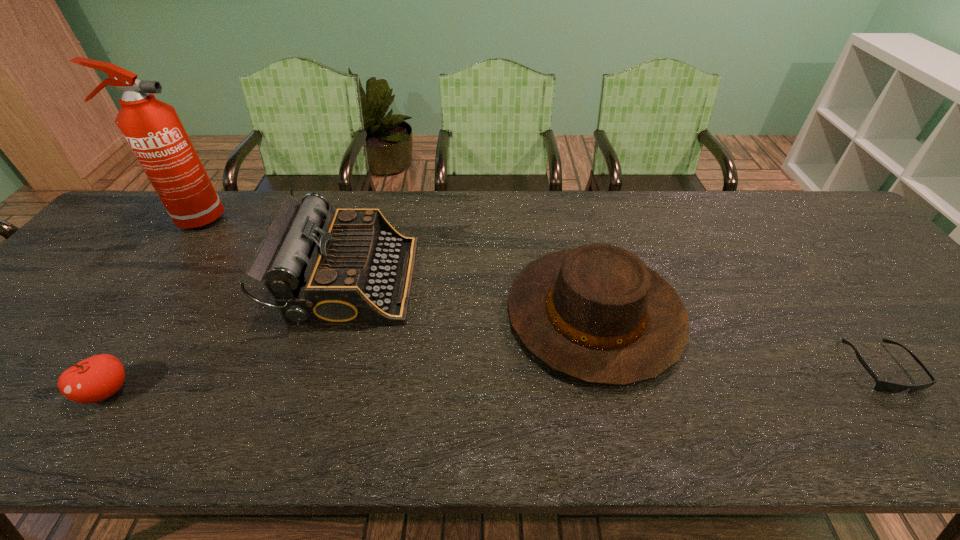
You are a GUI agent. You are given a task and a screenshot of the screen. Output one action in this format:
    pyautogui.click(x=<x>, y=<y>)
    Task: Click on the fire extinguisher
    The image size is (960, 540).
    Given the screenshot: What is the action you would take?
    pyautogui.click(x=152, y=128)

The height and width of the screenshot is (540, 960). Identify the location of the farthest object. (152, 128).

Locate an element on the screen. The width and height of the screenshot is (960, 540). the third object from right to left is located at coordinates (350, 266).

Where is `the fourth shortest object`? the fourth shortest object is located at coordinates (350, 266).

Identify the location of the third shortest object. Image resolution: width=960 pixels, height=540 pixels. (596, 313).

Locate an element on the screen. The image size is (960, 540). the fourth object from left to right is located at coordinates (596, 313).

The image size is (960, 540). In order to click on the second shortest object in this screenshot , I will do `click(94, 379)`.

Identify the location of the rightmost object. (883, 386).

You are a GUI agent. You are given a task and a screenshot of the screen. Output one action in this format:
    pyautogui.click(x=<x>, y=<y>)
    Task: Click on the shortest object
    
    Given the screenshot: What is the action you would take?
    pyautogui.click(x=883, y=386)

Locate an element on the screen. vacant space located 0.130m at the nozzle of the farthest object is located at coordinates (267, 219).